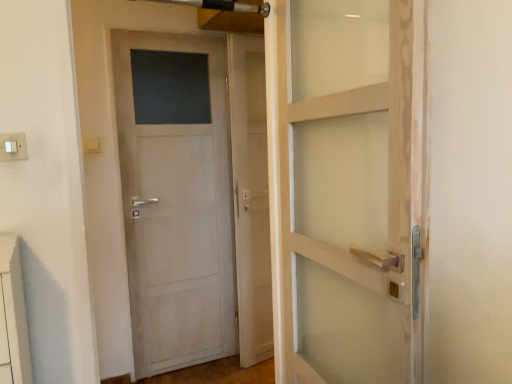
Question: Is white plastic switch at upper left taller or shorter than white wood door at left?

Choices:
 (A) short
 (B) tall

Answer: (A)

Question: Is point (20, 148) positioned closer to the camera than point (228, 264)?

Choices:
 (A) closer
 (B) farther

Answer: (A)

Question: Which of these objects is positioned closest to the transparent glass screen door at center?

Choices:
 (A) white wood door at left
 (B) white plastic switch at upper left

Answer: (A)

Question: Estimate the real-world distances between objects in this image. Which object is closer to the white wood door at left?

Choices:
 (A) white plastic switch at upper left
 (B) transparent glass screen door at center

Answer: (B)